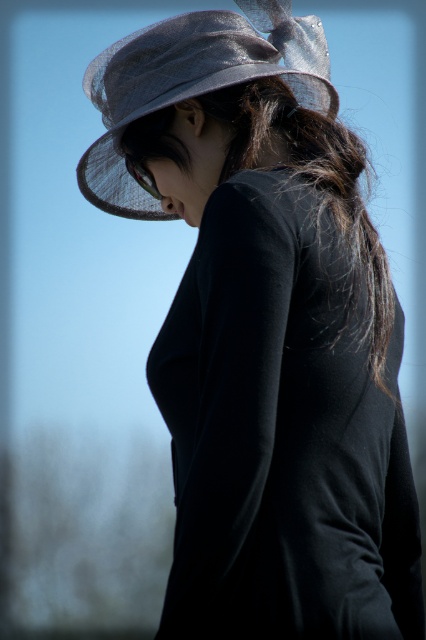
You are a photographer adjusting the camera focus. You notice two points in the scene at coordinates point (x=302, y=129) and point (x=322, y=83). Which point should you focus on if you want to prioritize the subject in the foreground?

Point (x=302, y=129) should be focused on because it is in front of point (x=322, y=83), making it closer to the camera and part of the foreground.

You are a photographer standing at the edge of a park. You want to take a portrait of the black silky hair at center. The subject is currently 5.35 feet away from you. According to photography guidelines, the ideal distance for a portrait is between 4 to 6 feet. Is the current distance suitable for a portrait?

The subject is currently 5.35 feet away, which falls within the ideal distance range of 4 to 6 feet for a portrait. This distance is suitable for capturing a clear, flattering portrait of the black silky hair at center.